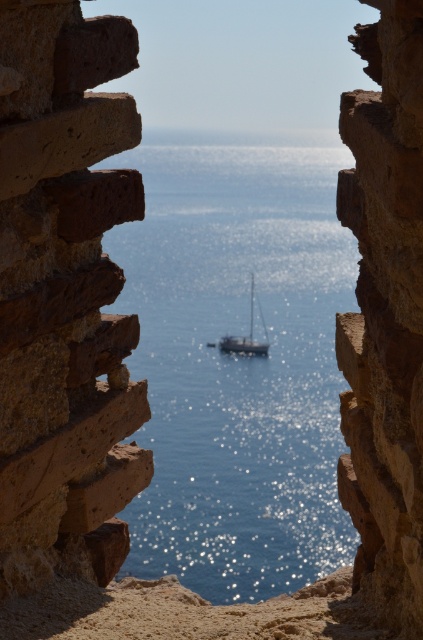
Does brown rough cliff at center appear under white glossy sailboat at center?

Indeed, brown rough cliff at center is positioned under white glossy sailboat at center.

I want to click on brown rough cliff at center, so click(386, 314).

In the scene shown: Does brown rough stone at center have a smaller size compared to white glossy sailboat at center?

Yes, brown rough stone at center is smaller than white glossy sailboat at center.

This screenshot has height=640, width=423. Describe the element at coordinates (65, 296) in the screenshot. I see `brown rough stone at center` at that location.

The width and height of the screenshot is (423, 640). Identify the location of brown rough stone at center. (65, 296).

Does blue glossy water at center have a lesser width compared to brown rough cliff at center?

In fact, blue glossy water at center might be wider than brown rough cliff at center.

Does blue glossy water at center have a greater height compared to brown rough cliff at center?

Indeed, blue glossy water at center has a greater height compared to brown rough cliff at center.

Where is `blue glossy water at center`? Image resolution: width=423 pixels, height=640 pixels. blue glossy water at center is located at coordinates (238, 365).